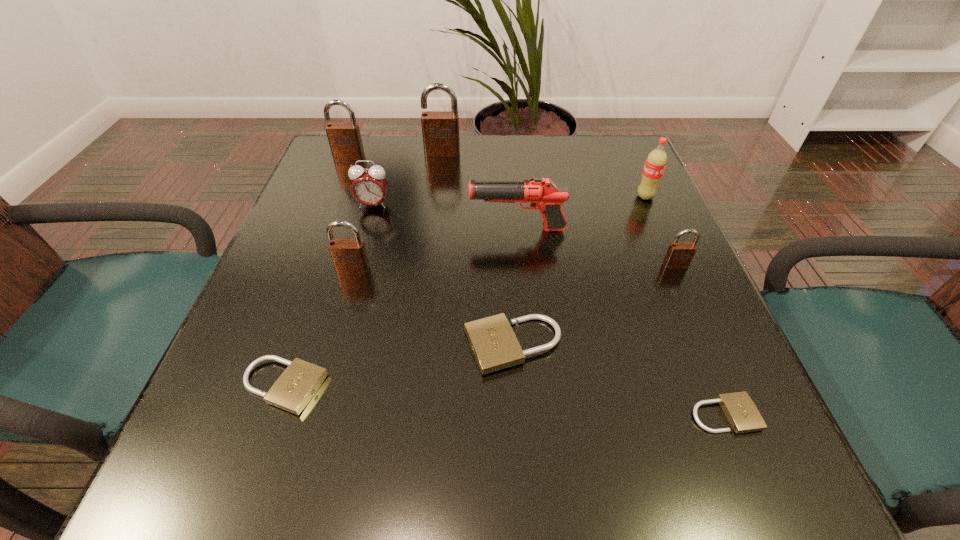
Locate which padlock is the third closest to the alarm clock. Please provide its 2D coordinates. Your answer should be formatted as a tuple, i.e. [(x, y)], where the tuple contains the x and y coordinates of a point satisfying the conditions above.

[(440, 129)]

Locate an element on the screen. This screenshot has height=540, width=960. brown padlock that is the closest to the soda is located at coordinates (679, 255).

Identify the location of the fourth closest brown padlock to the second beige padlock from left to right. (345, 141).

Find the location of a particular element. The width and height of the screenshot is (960, 540). beige padlock that is the second closest to the biggest brown padlock is located at coordinates (292, 391).

Choose which beige padlock is the nearest neighbor to the soda. Please provide its 2D coordinates. Your answer should be formatted as a tuple, i.e. [(x, y)], where the tuple contains the x and y coordinates of a point satisfying the conditions above.

[(494, 344)]

The height and width of the screenshot is (540, 960). What are the coordinates of `free space that satisfies the following two spatial constraints: 1. on the front-facing side of the third tallest padlock; 2. on the right side of the shortest padlock` in the screenshot? It's located at (313, 414).

Where is `blank space that satisfies the following two spatial constraints: 1. on the front-facing side of the sixth tallest padlock; 2. on the left side of the third smallest brown padlock`? blank space that satisfies the following two spatial constraints: 1. on the front-facing side of the sixth tallest padlock; 2. on the left side of the third smallest brown padlock is located at coordinates (260, 386).